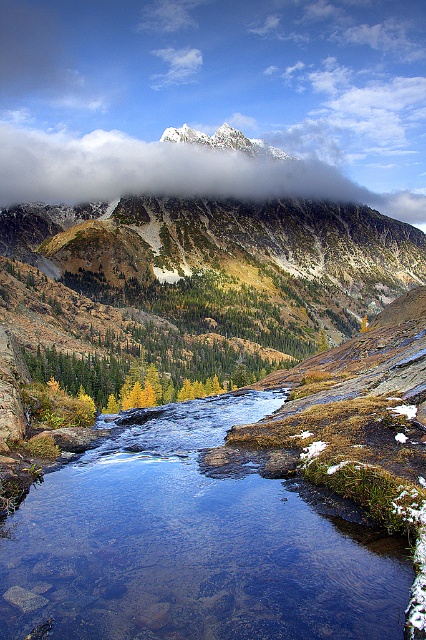
From the picture: Is clear water stream at center closer to the viewer compared to white fluffy cloud at upper center?

Yes, it is.

How far apart are clear water stream at center and white fluffy cloud at upper center?

clear water stream at center and white fluffy cloud at upper center are 440.53 meters apart.

Find the location of a particular element. This screenshot has width=426, height=640. clear water stream at center is located at coordinates (189, 545).

Identify the location of clear water stream at center. (189, 545).